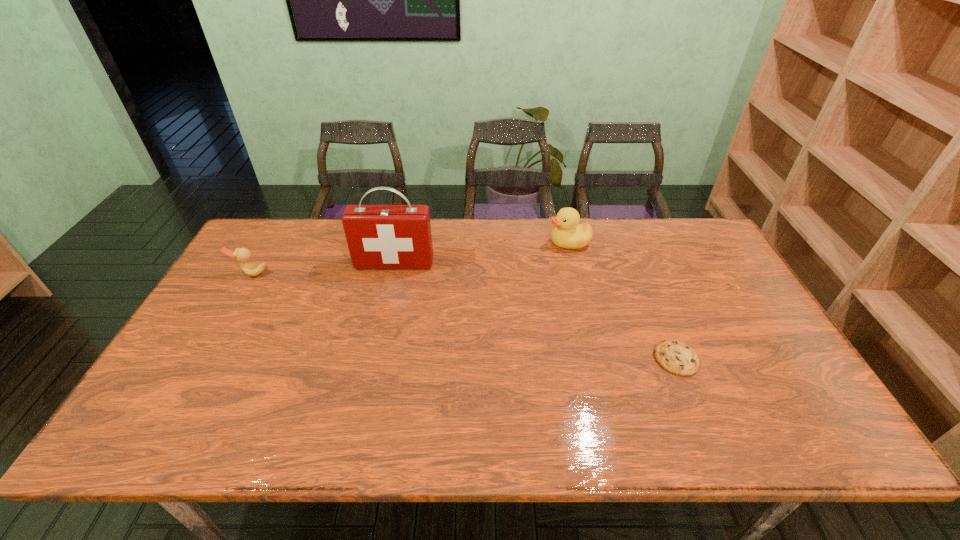
I want to click on the second object from left to right, so click(378, 236).

This screenshot has height=540, width=960. I want to click on the first-aid kit, so click(378, 236).

Image resolution: width=960 pixels, height=540 pixels. I want to click on the third object from left to right, so click(x=568, y=233).

The width and height of the screenshot is (960, 540). In order to click on the farthest object in this screenshot , I will do `click(568, 233)`.

Identify the location of the third tallest object. (241, 255).

Find the location of a particular element. The image size is (960, 540). the leftmost object is located at coordinates (241, 255).

Locate an element on the screen. This screenshot has height=540, width=960. the nearest object is located at coordinates (676, 357).

The height and width of the screenshot is (540, 960). In order to click on the shortest object in this screenshot , I will do `click(676, 357)`.

Locate an element on the screen. This screenshot has width=960, height=540. vacant space situated 0.080m on the front face of the tallest object is located at coordinates (389, 288).

Where is `blank space located 0.290m at the beak of the second object from right to left`? This screenshot has width=960, height=540. blank space located 0.290m at the beak of the second object from right to left is located at coordinates (462, 242).